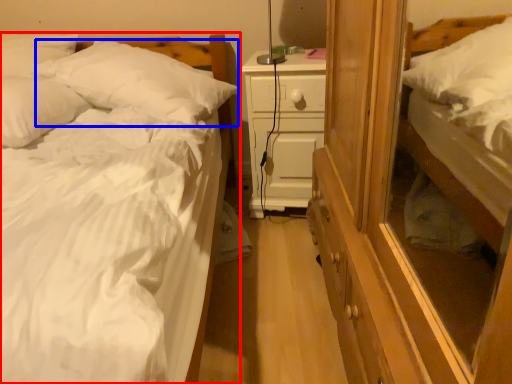
Question: Which of the following is the closest to the observer, bed (highlighted by a red box) or pillow (highlighted by a blue box)?

Choices:
 (A) bed
 (B) pillow

Answer: (A)